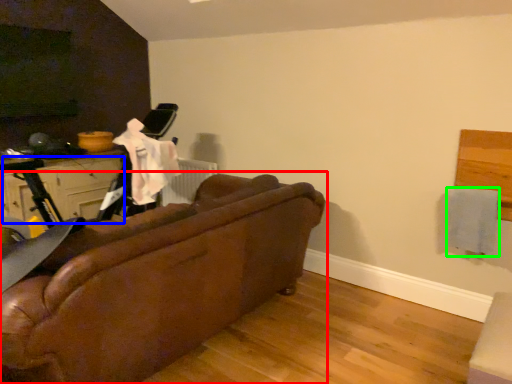
Question: Estimate the real-world distances between objects in this image. Which object is farther from studio couch (highlighted by a red box), drawer (highlighted by a blue box) or clothe (highlighted by a green box)?

Choices:
 (A) drawer
 (B) clothe

Answer: (A)